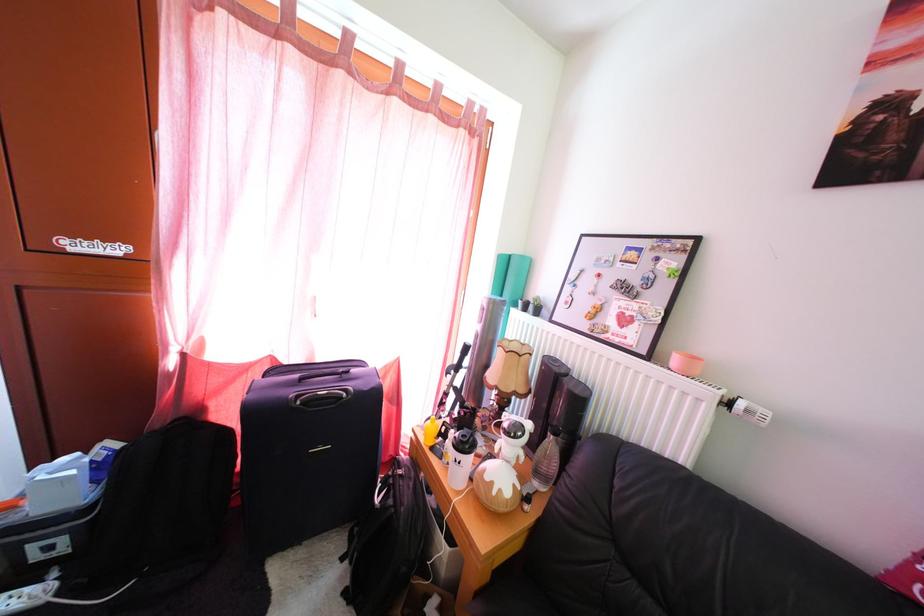
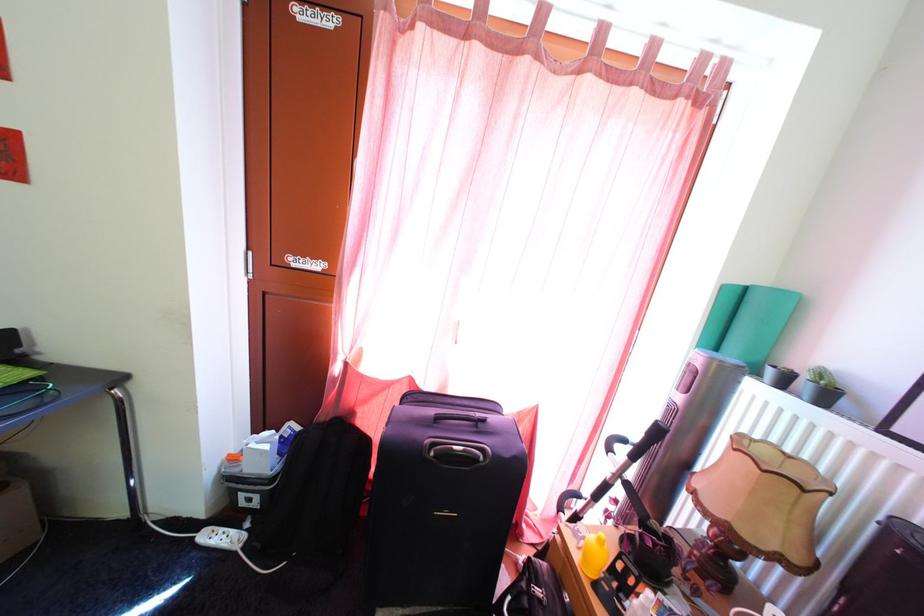
Locate, in the second image, the point that corresponds to (x=71, y=557) in the first image.

(264, 512)